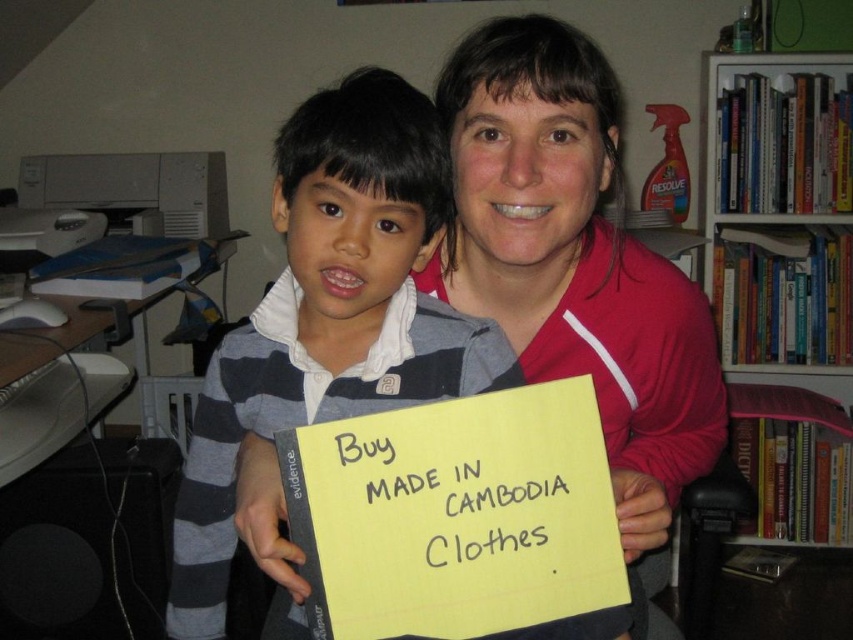
Question: Is matte red jacket at center wider than yellow paper at center?

Choices:
 (A) yes
 (B) no

Answer: (A)

Question: Which point is farther from the camera taking this photo?

Choices:
 (A) (219, 470)
 (B) (537, 56)
 (C) (547, 512)

Answer: (A)

Question: Considering the real-world distances, which object is closest to the striped cotton shirt at center?

Choices:
 (A) matte red jacket at center
 (B) white paperboard bookshelf at upper right
 (C) yellow paper at center

Answer: (A)

Question: Can you confirm if white paperboard bookshelf at upper right is bigger than yellow paper at center?

Choices:
 (A) yes
 (B) no

Answer: (A)

Question: Which point appears farthest from the camera in this image?

Choices:
 (A) (376, 438)
 (B) (838, 308)
 (C) (498, 241)
 (D) (230, 440)

Answer: (B)

Question: Is white paperboard bookshelf at upper right smaller than yellow paper at center?

Choices:
 (A) no
 (B) yes

Answer: (A)